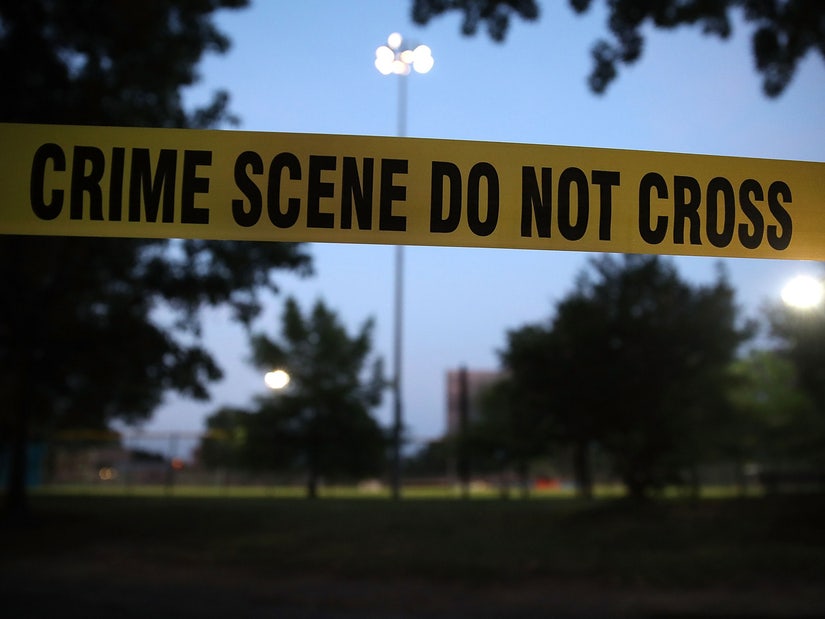
Locate an element on the screen. Image resolution: width=825 pixels, height=619 pixels. overhead lights is located at coordinates (401, 51), (279, 378), (800, 293).